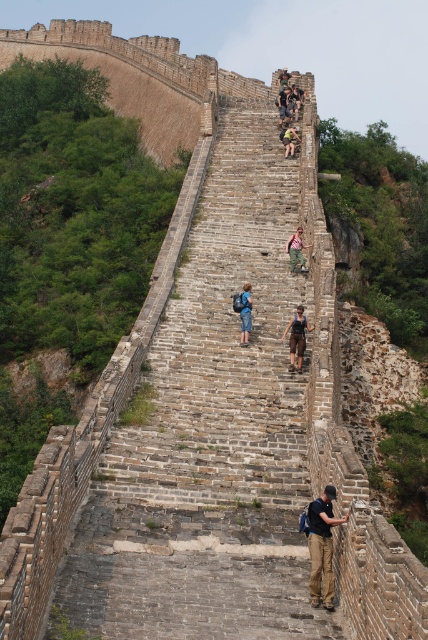
Question: Does blue denim jeans at center appear under green fabric backpack at upper center?

Choices:
 (A) no
 (B) yes

Answer: (B)

Question: Which point is closer to the camera taking this photo?

Choices:
 (A) tap(249, 294)
 (B) tap(285, 141)
 (C) tap(279, 122)

Answer: (A)

Question: Is dark brown leather pants at center in front of brown fabric backpack at center?

Choices:
 (A) yes
 (B) no

Answer: (A)

Question: Which is farther from the brown leather backpack at center?

Choices:
 (A) blue denim jeans at center
 (B) dark blue jeans at center
 (C) brown fabric backpack at center
 (D) dark brown leather pants at center

Answer: (B)

Question: Which object is farther from the camera taking this photo?

Choices:
 (A) brown fabric backpack at center
 (B) dark brown leather pants at center
 (C) blue denim jeans at center

Answer: (C)

Question: Does brown fabric backpack at center appear under dark blue jeans at center?

Choices:
 (A) no
 (B) yes

Answer: (B)